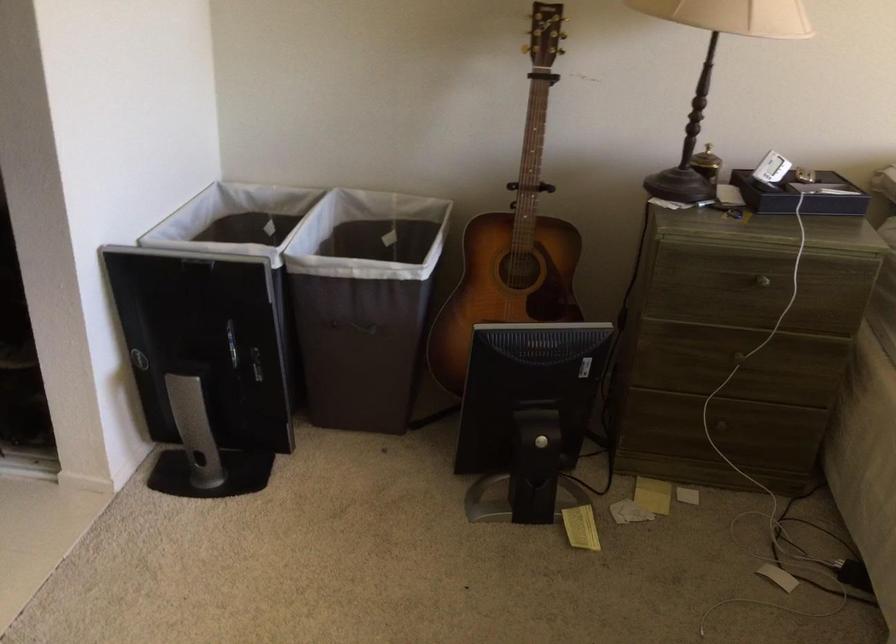
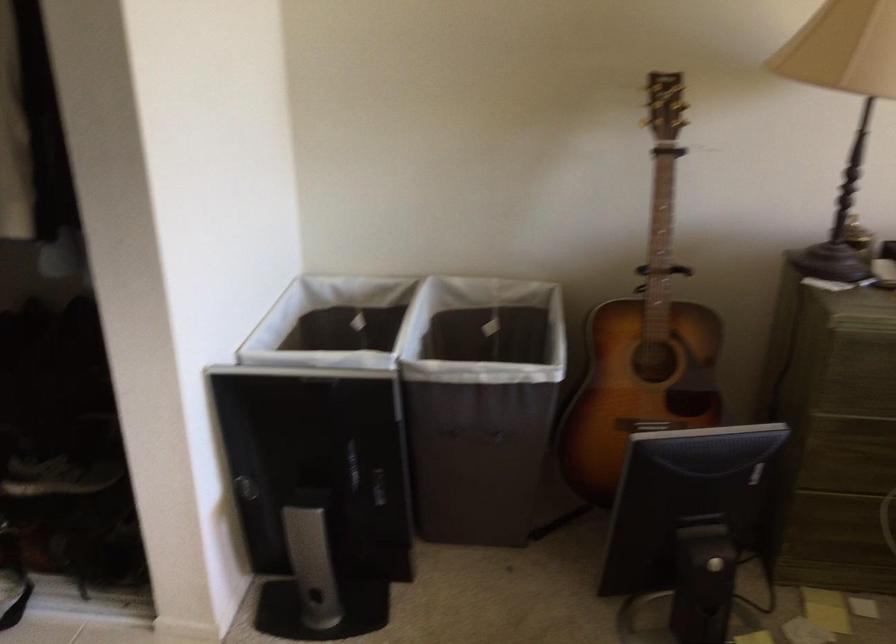
In a continuous first-person perspective shot, in which direction is the camera moving?

The cameraman walked toward left, forward.